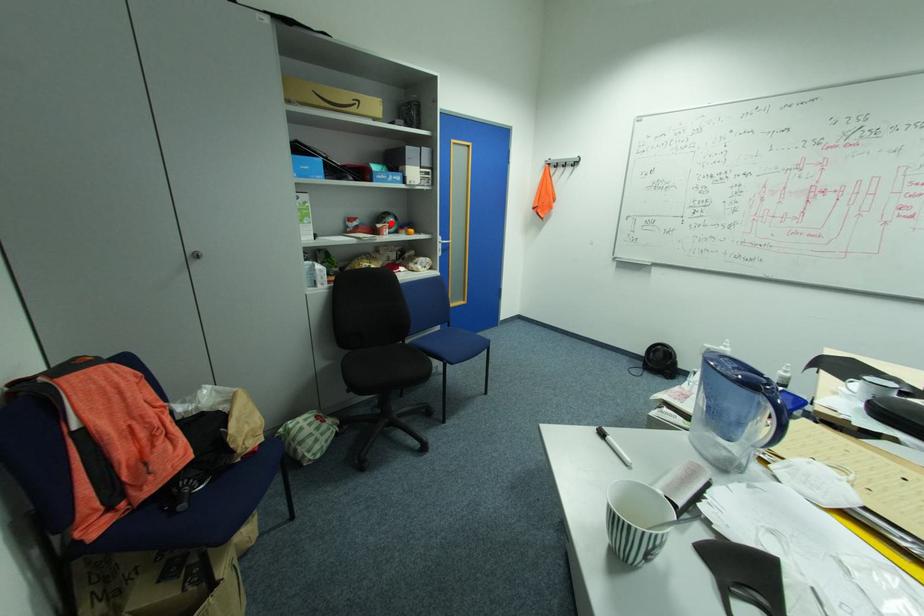
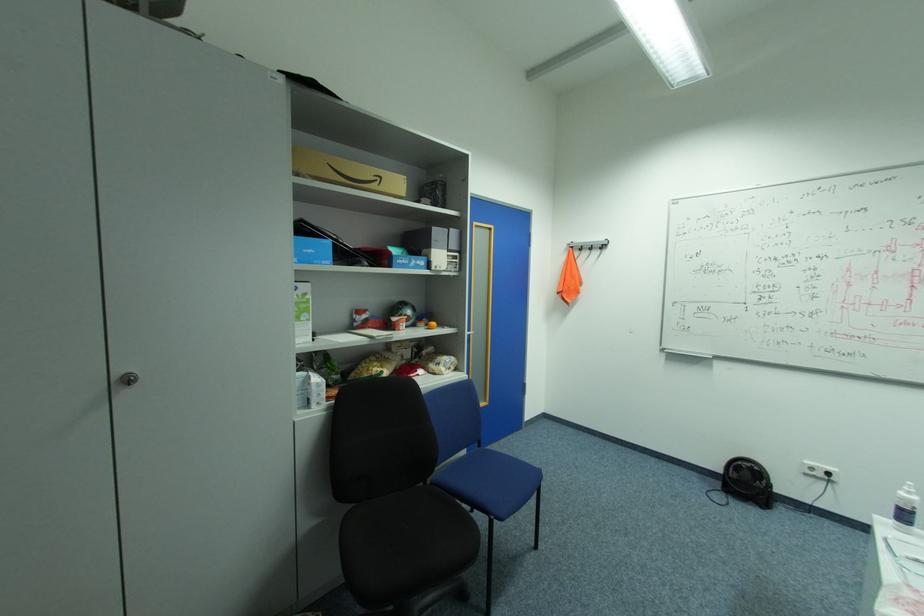
The point at the highlighted location is marked in the first image. Where is the corresponding point in the second image?

(407, 315)